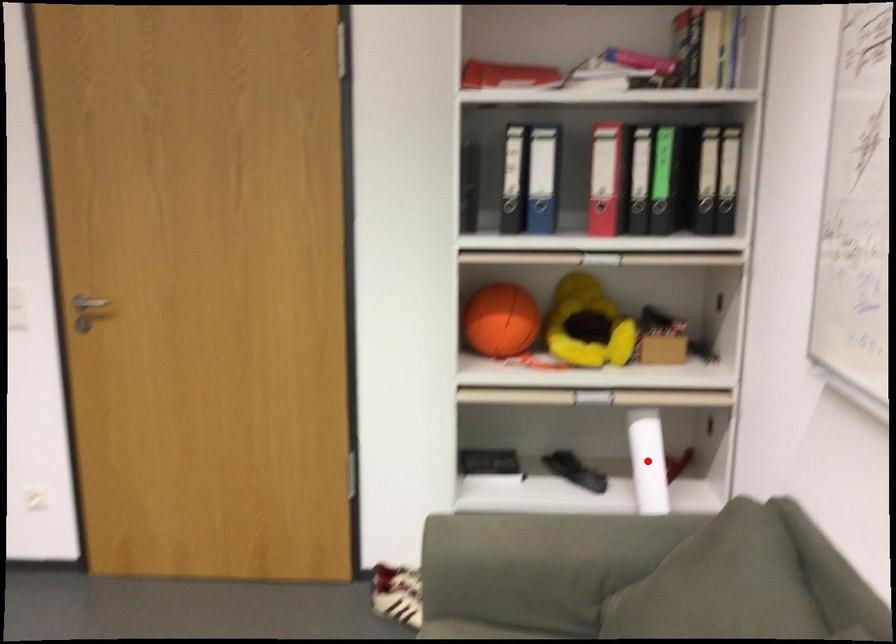
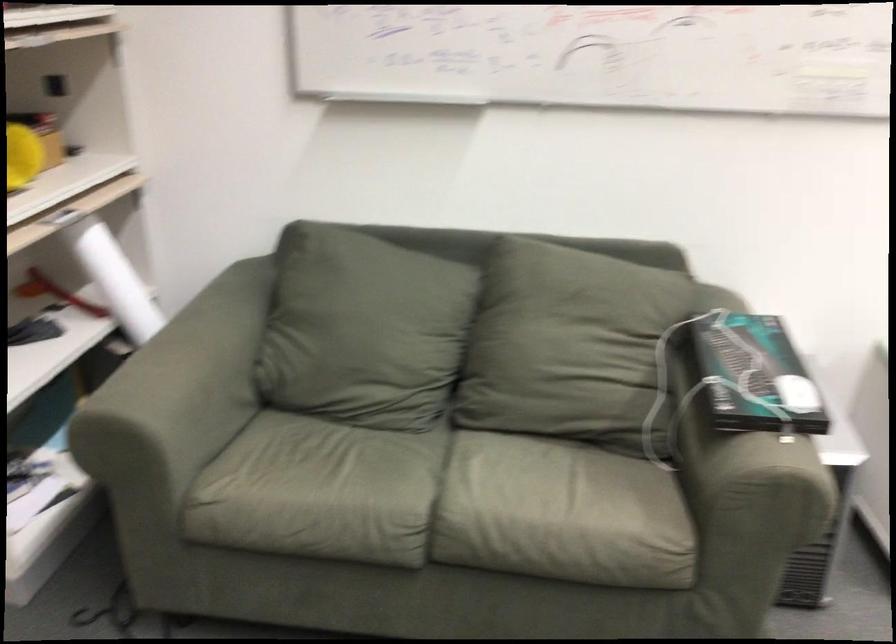
Question: I am providing you with two images of the same scene from different viewpoints. A red point is marked on the first image. At the location where the point appears in image 1, is it still visible in image 2?

Choices:
 (A) Yes
 (B) No

Answer: (B)